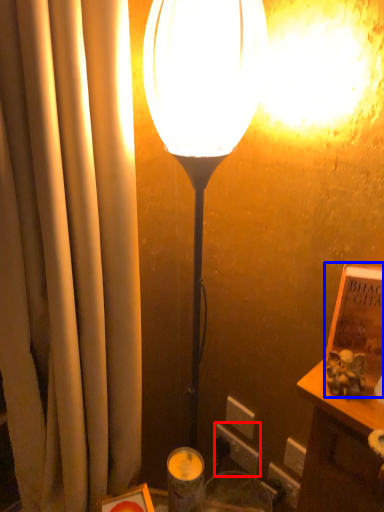
Question: Which point is closer to the camera, electric outlet (highlighted by a red box) or book (highlighted by a blue box)?

Choices:
 (A) electric outlet
 (B) book

Answer: (B)